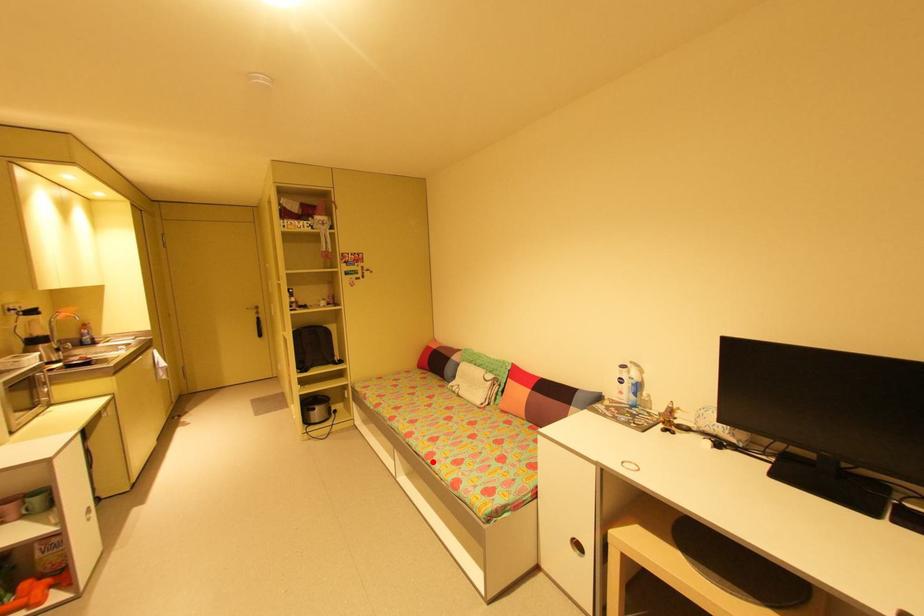
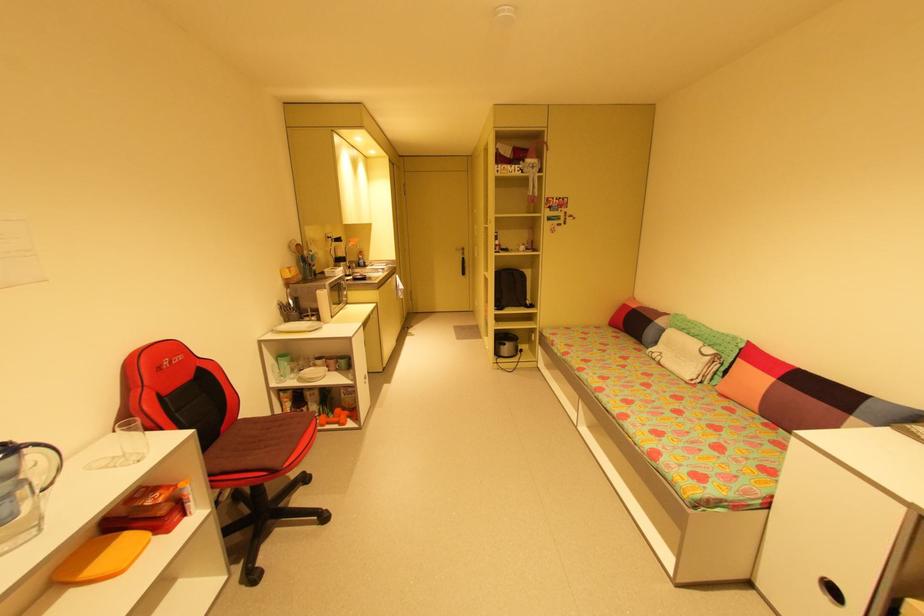
The point at the highlighted location is marked in the first image. Where is the corresponding point in the second image?

(625, 422)